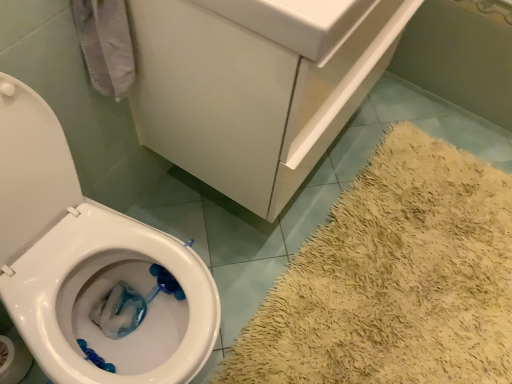
Question: From the image's perspective, is white glossy bathtub at lower right beneath white paper at lower left?

Choices:
 (A) yes
 (B) no

Answer: (B)

Question: Is white glossy bathtub at lower right bigger than white paper at lower left?

Choices:
 (A) no
 (B) yes

Answer: (B)

Question: Is white glossy bathtub at lower right far away from white paper at lower left?

Choices:
 (A) no
 (B) yes

Answer: (B)

Question: From a real-world perspective, is white glossy bathtub at lower right physically below white paper at lower left?

Choices:
 (A) yes
 (B) no

Answer: (B)

Question: Is white glossy bathtub at lower right facing towards white paper at lower left?

Choices:
 (A) yes
 (B) no

Answer: (A)

Question: Visually, is white glossy bathtub at lower right positioned to the left or to the right of white paper at lower left?

Choices:
 (A) right
 (B) left

Answer: (A)

Question: Considering the positions of point 455,51 and point 1,339, is point 455,51 closer or farther from the camera than point 1,339?

Choices:
 (A) farther
 (B) closer

Answer: (A)

Question: From their relative heights in the image, would you say white glossy bathtub at lower right is taller or shorter than white paper at lower left?

Choices:
 (A) short
 (B) tall

Answer: (B)

Question: Is white glossy bathtub at lower right bigger or smaller than white paper at lower left?

Choices:
 (A) small
 (B) big

Answer: (B)

Question: In the image, is white paper at lower left positioned in front of or behind white glossy bathtub at lower right?

Choices:
 (A) behind
 (B) front

Answer: (B)

Question: From a real-world perspective, is white paper at lower left positioned above or below white glossy bathtub at lower right?

Choices:
 (A) below
 (B) above

Answer: (A)

Question: From their relative heights in the image, would you say white paper at lower left is taller or shorter than white glossy bathtub at lower right?

Choices:
 (A) tall
 (B) short

Answer: (B)

Question: From the image's perspective, is white paper at lower left located above or below white glossy bathtub at lower right?

Choices:
 (A) below
 (B) above

Answer: (A)

Question: Would you say white glossy sink at upper center is inside or outside white glossy bathtub at lower right?

Choices:
 (A) inside
 (B) outside

Answer: (B)

Question: Is white glossy sink at upper center bigger or smaller than white glossy bathtub at lower right?

Choices:
 (A) small
 (B) big

Answer: (A)